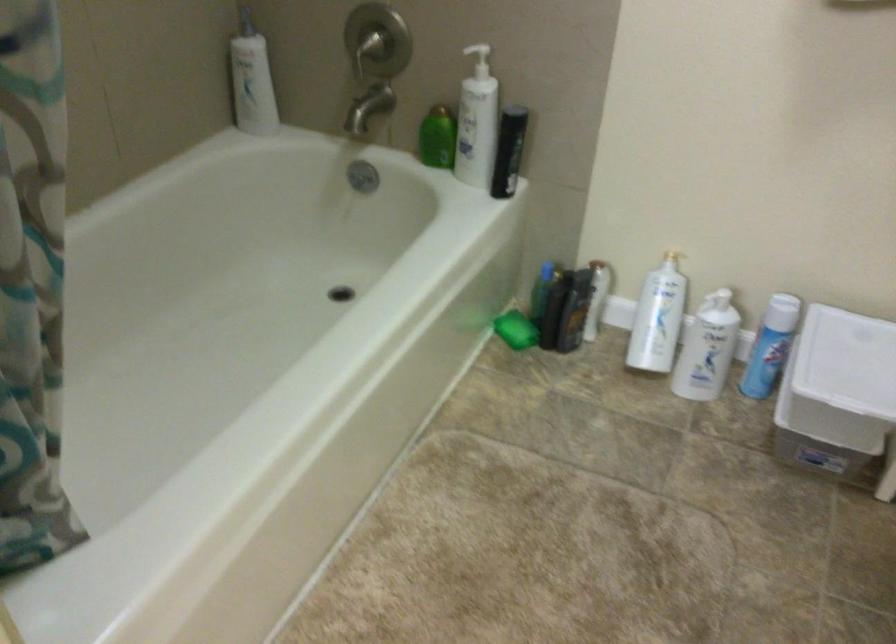
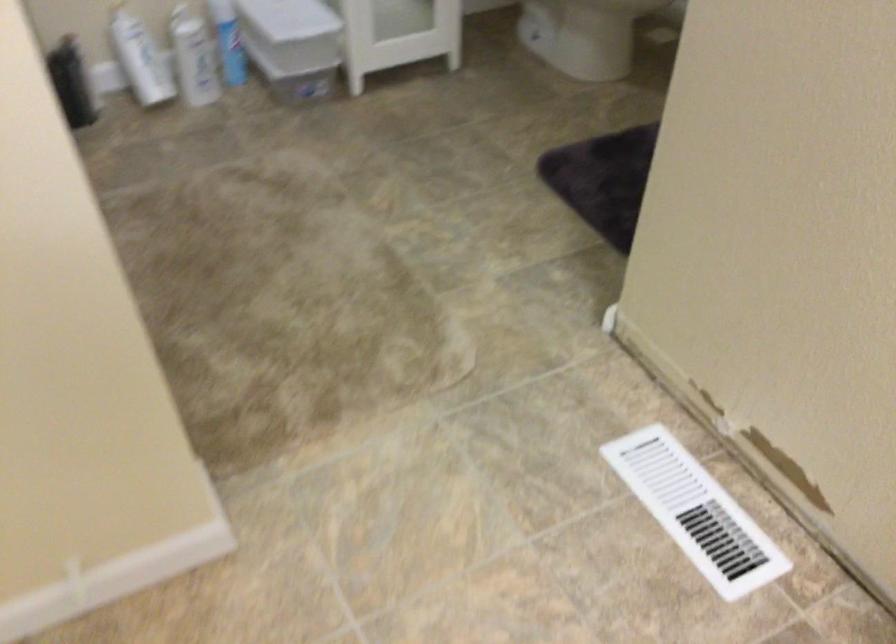
In the second image, find the point that corresponds to the point at 753,346 in the first image.

(228, 41)